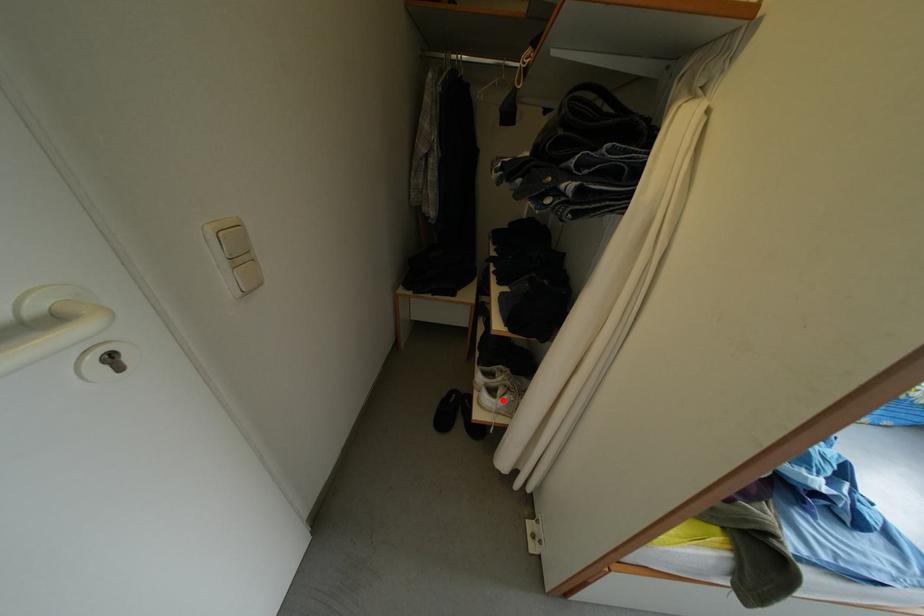
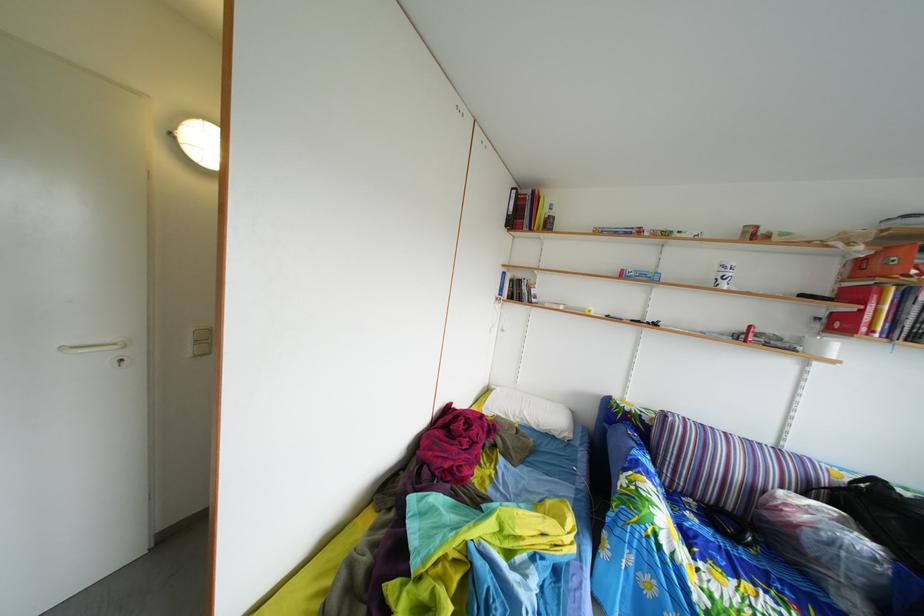
Question: I am providing you with two images of the same scene from different viewpoints. A red point is marked on the first image. At the location where the point appears in image 1, is it still visible in image 2?

Choices:
 (A) Yes
 (B) No

Answer: (B)